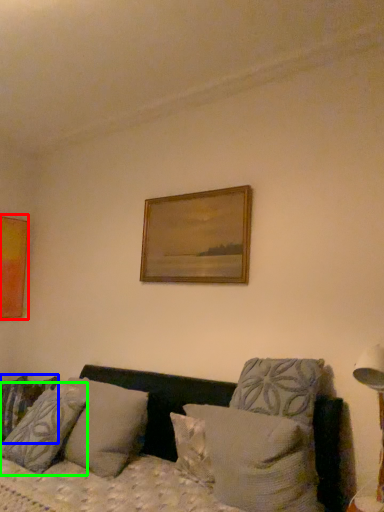
Question: Based on their relative distances, which object is nearer to picture frame (highlighted by a red box)? Choose from pillow (highlighted by a blue box) and pillow (highlighted by a green box).

Choices:
 (A) pillow
 (B) pillow

Answer: (A)